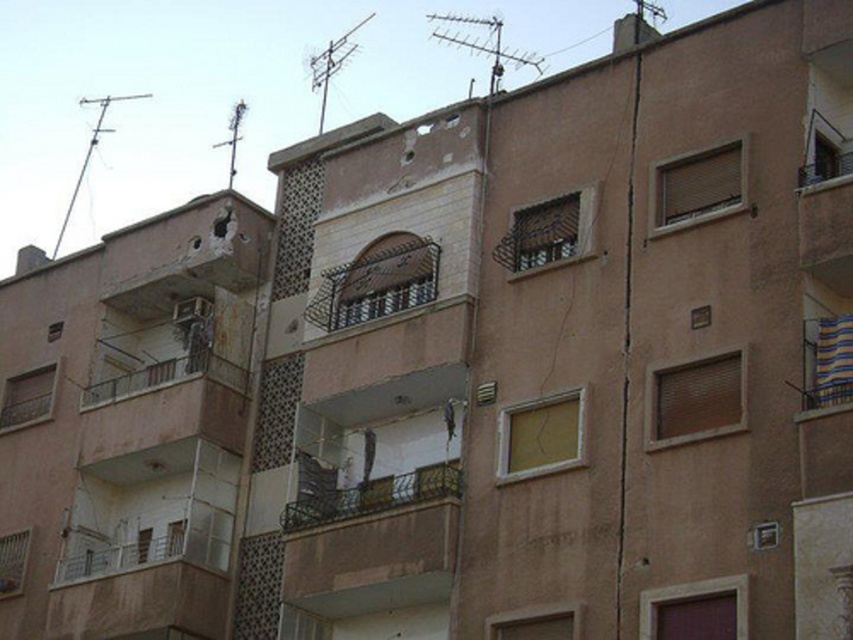
You are standing on the sidewalk in front of the building and want to take a photo of both the white textured window at upper right and the matte white window at lower left. Which window should you frame first in your camera viewfinder to ensure both are visible in the photo?

You should frame the matte white window at lower left first because the white textured window at upper right is positioned to its right, so starting with the left window allows both to be captured in the frame.